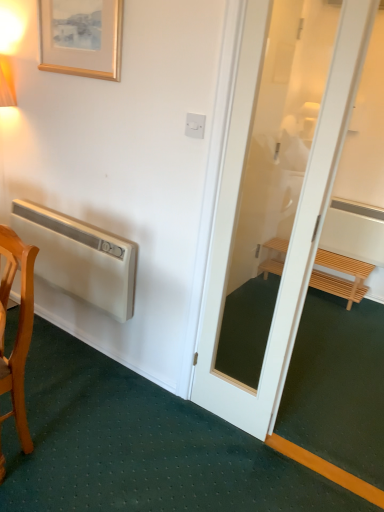
Question: Based on their positions, is wooden chair at lower left located to the left or right of white matte air conditioner at left?

Choices:
 (A) left
 (B) right

Answer: (A)

Question: From the image's perspective, is wooden chair at lower left located above or below white matte air conditioner at left?

Choices:
 (A) below
 (B) above

Answer: (A)

Question: Estimate the real-world distances between objects in this image. Which object is closer to the wooden framed print at upper left?

Choices:
 (A) wooden chair at lower left
 (B) white matte air conditioner at left
 (C) light brown wooden bench at right

Answer: (B)

Question: Estimate the real-world distances between objects in this image. Which object is closer to the wooden chair at lower left?

Choices:
 (A) light brown wooden bench at right
 (B) white matte air conditioner at left
 (C) wooden framed print at upper left

Answer: (B)